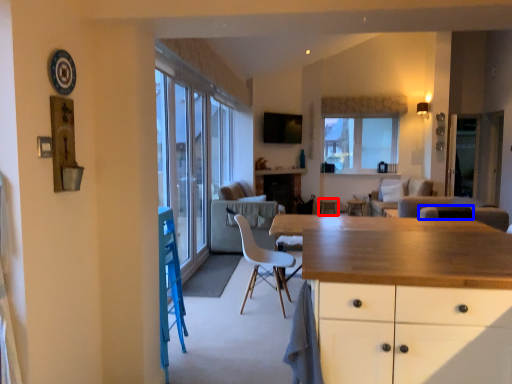
Question: Which object is further to the camera taking this photo, bar stool (highlighted by a red box) or armchair (highlighted by a blue box)?

Choices:
 (A) bar stool
 (B) armchair

Answer: (A)